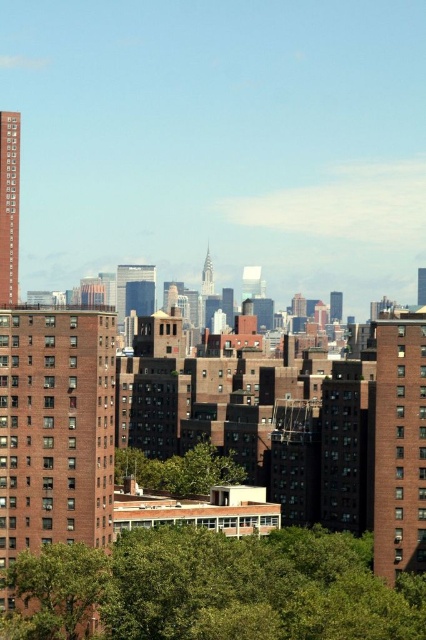
You are standing in the city and looking at the green leafy tree at lower left and the green leafy tree at center. Which tree is positioned lower in the frame?

The green leafy tree at lower left is positioned lower in the frame than the green leafy tree at center.

You are standing at the base of the green leafy tree at lower center. You want to throw a ball to a friend who is standing 250 meters away from you. Can you reach your friend with a single throw?

The distance between the green leafy tree at lower center and the viewer is 269.19 meters. Since your friend is only 250 meters away from you, your throw would need to cover 250 meters, but the tree is already 269.19 meters away from your position. Therefore, you cannot reach your friend with a single throw because the required distance exceeds the distance to the tree.